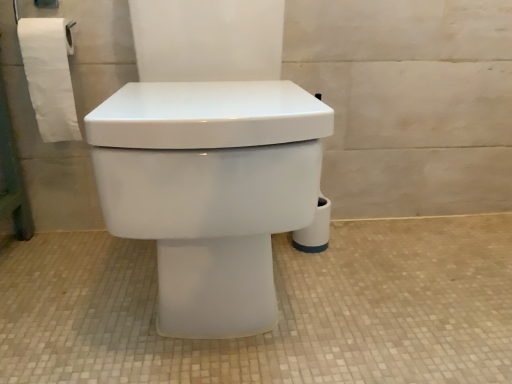
Find the location of a particular element. vacant space to the right of white glossy toilet at center is located at coordinates (395, 281).